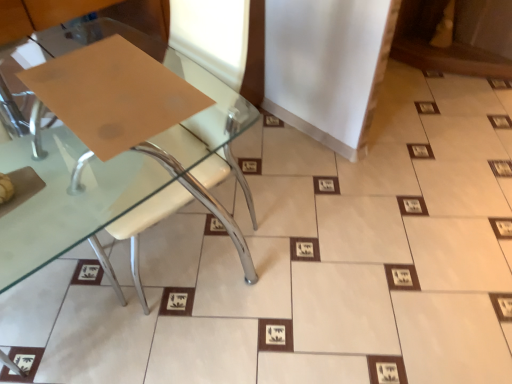
Question: From the image's perspective, is matte brown paper at lower left above or below matte brown paper at upper left?

Choices:
 (A) below
 (B) above

Answer: (A)

Question: Considering their positions, is matte brown paper at lower left located in front of or behind matte brown paper at upper left?

Choices:
 (A) front
 (B) behind

Answer: (A)

Question: Is point (246, 193) positioned closer to the camera than point (159, 130)?

Choices:
 (A) closer
 (B) farther

Answer: (B)

Question: Is matte brown paper at upper left situated inside matte brown paper at lower left or outside?

Choices:
 (A) outside
 (B) inside

Answer: (B)

Question: Looking at their shapes, would you say matte brown paper at upper left is wider or thinner than matte brown paper at lower left?

Choices:
 (A) wide
 (B) thin

Answer: (B)

Question: Relative to matte brown paper at lower left, is matte brown paper at upper left in front or behind?

Choices:
 (A) front
 (B) behind

Answer: (B)

Question: Is matte brown paper at upper left bigger or smaller than matte brown paper at lower left?

Choices:
 (A) big
 (B) small

Answer: (B)